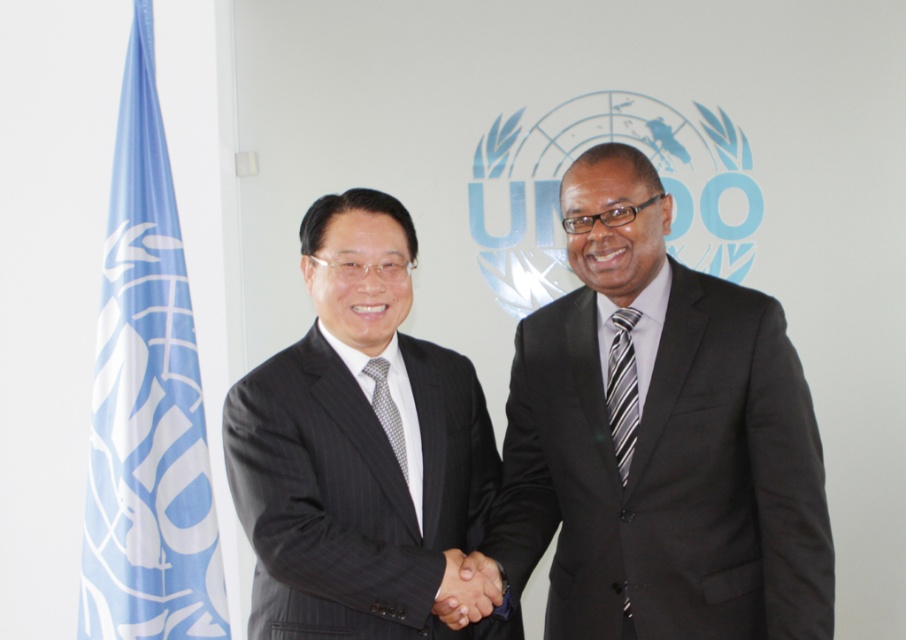
Between point (702, 371) and point (631, 364), which one is positioned behind?

Point (631, 364)

Does black suit at center appear over striped fabric tie at center?

No, black suit at center is not above striped fabric tie at center.

Is point (670, 614) closer to camera compared to point (625, 419)?

Yes.

Image resolution: width=906 pixels, height=640 pixels. What are the coordinates of `black suit at center` in the screenshot? It's located at (660, 442).

Which is more to the right, striped fabric tie at center or gray dotted tie at center?

striped fabric tie at center is more to the right.

Who is more forward, (618,433) or (386,364)?

Point (618,433) is more forward.

At what (x,y) coordinates should I click in order to perform the action: click on striped fabric tie at center. Please return your answer as a coordinate pair (x, y). Image resolution: width=906 pixels, height=640 pixels. Looking at the image, I should click on (622, 388).

Does matte black suit at center have a larger size compared to blue fabric flag at left?

Correct, matte black suit at center is larger in size than blue fabric flag at left.

Who is more distant from viewer, (359, 312) or (149, 358)?

Point (149, 358)

I want to click on matte black suit at center, so point(358,449).